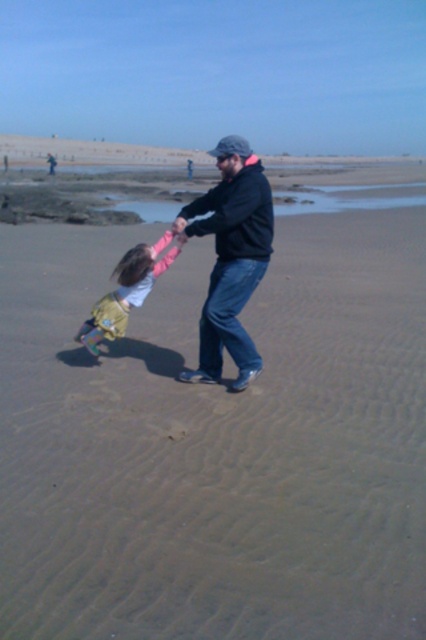
Question: Is black matte jacket at center closer to the viewer compared to light pink fabric dress at lower left?

Choices:
 (A) yes
 (B) no

Answer: (A)

Question: Which point is closer to the camera?

Choices:
 (A) (244, 173)
 (B) (137, 248)

Answer: (A)

Question: Can you confirm if black matte jacket at center is bigger than light pink fabric dress at lower left?

Choices:
 (A) no
 (B) yes

Answer: (B)

Question: Among these points, which one is farthest from the camera?

Choices:
 (A) (132, 260)
 (B) (261, 196)

Answer: (A)

Question: Is black matte jacket at center positioned at the back of light pink fabric dress at lower left?

Choices:
 (A) no
 (B) yes

Answer: (A)